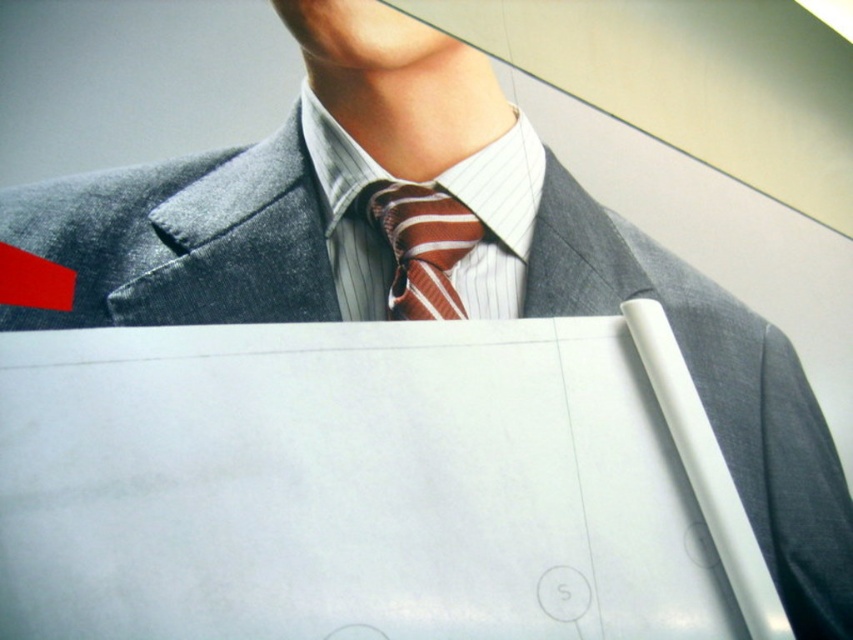
You are an artist who needs to place a new element on your canvas. You have a white paper at center. Where exactly should you place it to match the existing composition?

The white paper at center should be placed at the 2D coordinates point (369,484) to align with the existing composition.

You are a photographer adjusting the focus of your camera. You notice two points in the image at coordinates point (54, 515) and point (422, 256). Which point should you focus on first if you want to ensure the closest object is sharp?

Point (54, 515) is closer to the camera than point (422, 256), so you should focus on point (54, 515) first to ensure the closest object is sharp.